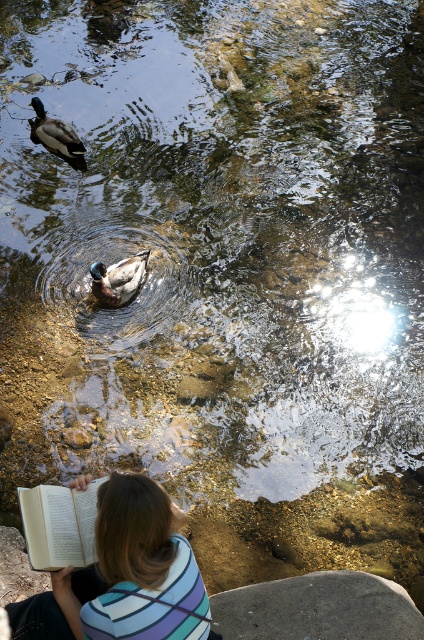
From the picture: You are a photographer trying to capture a clear photo of the shiny brown duck at center without the white paper book at lower left appearing in the foreground. Can you adjust your position to do so?

The white paper book at lower left is in front of the shiny brown duck at center, so moving your position to the left or right would allow you to frame the photo so the shiny brown duck at center is visible without the white paper book at lower left blocking it.

You are standing at the point labeled point [47,147] and want to walk to the point labeled point [134,275]. Which direction should you move to reach your destination?

You should move forward to reach point [134,275] because it is in front of point [47,147].